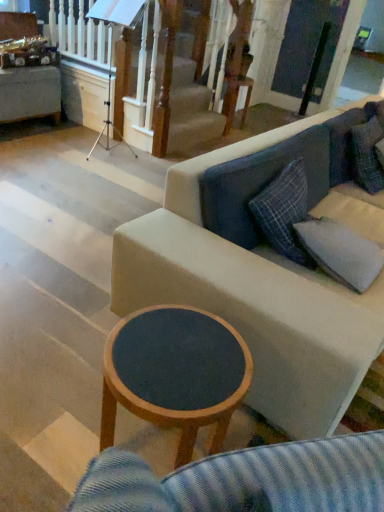
At what (x,y) coordinates should I click in order to perform the action: click on vacant area situated to the left side of wooden round table at center. Please return your answer as a coordinate pair (x, y). This screenshot has width=384, height=512. Looking at the image, I should click on (52, 424).